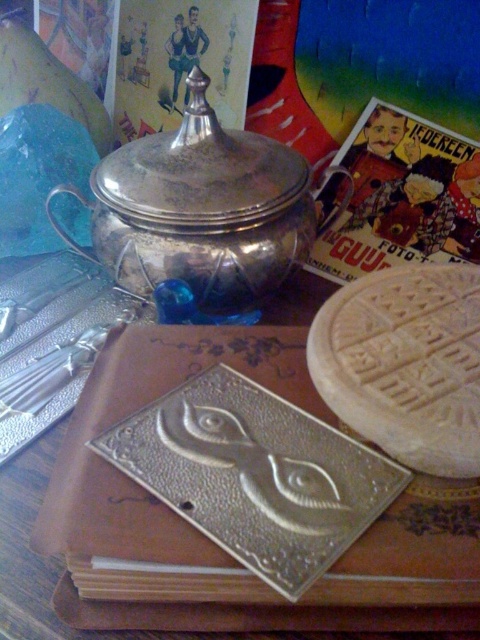
Question: Can you confirm if shiny silver teapot at upper center is positioned to the left of matte paper book at upper right?

Choices:
 (A) yes
 (B) no

Answer: (A)

Question: Does shiny silver teapot at upper center have a lesser width compared to matte paper book at upper right?

Choices:
 (A) yes
 (B) no

Answer: (B)

Question: Which point appears farthest from the camera in this image?

Choices:
 (A) (189, 252)
 (B) (455, 160)

Answer: (B)

Question: Among these objects, which one is nearest to the camera?

Choices:
 (A) matte paper book at upper right
 (B) shiny silver teapot at upper center

Answer: (B)

Question: Among these points, which one is nearest to the camera?

Choices:
 (A) (219, 177)
 (B) (409, 113)

Answer: (A)

Question: Observing the image, what is the correct spatial positioning of shiny silver teapot at upper center in reference to matte paper book at upper right?

Choices:
 (A) above
 (B) below

Answer: (B)